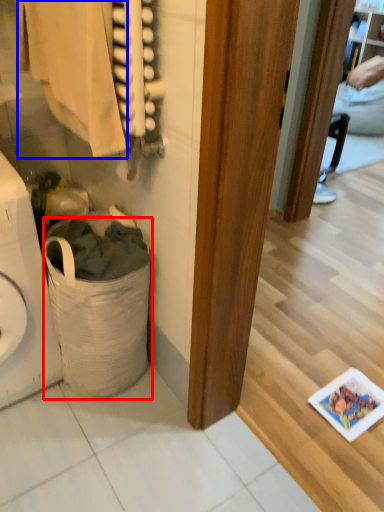
Question: Which object is further to the camera taking this photo, laundry basket (highlighted by a red box) or clothing (highlighted by a blue box)?

Choices:
 (A) laundry basket
 (B) clothing

Answer: (A)